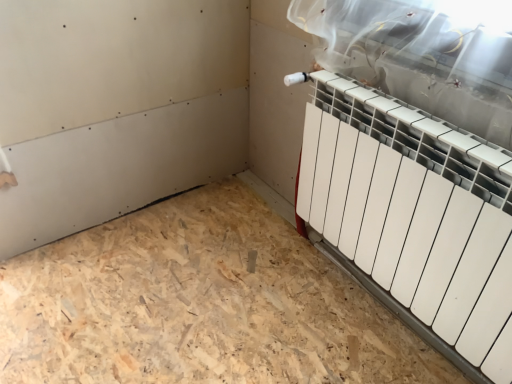
At what (x,y) coordinates should I click in order to perform the action: click on white matte radiator at upper right. Please return your answer as a coordinate pair (x, y). The height and width of the screenshot is (384, 512). Looking at the image, I should click on (415, 213).

Image resolution: width=512 pixels, height=384 pixels. Describe the element at coordinates (415, 213) in the screenshot. I see `white matte radiator at upper right` at that location.

I want to click on white matte radiator at upper right, so click(x=415, y=213).